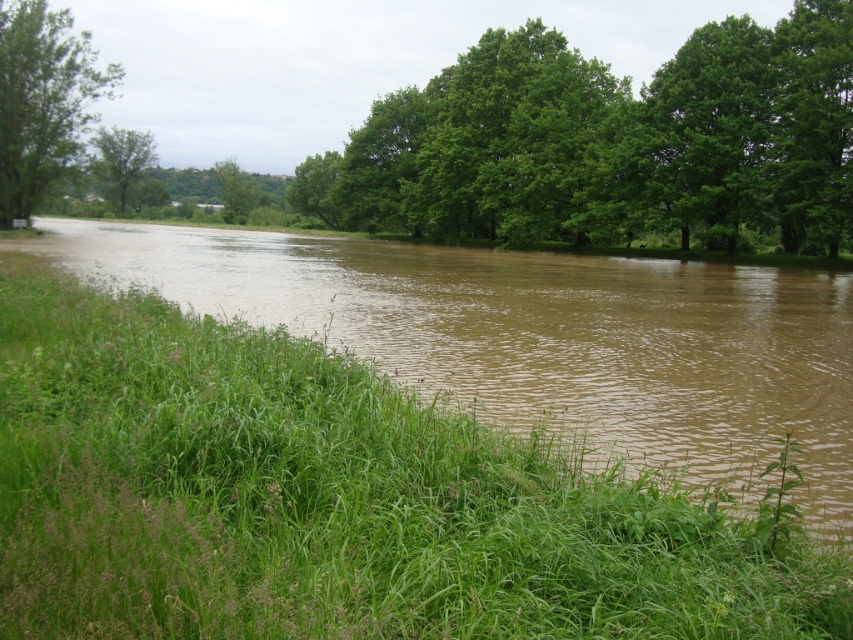
Question: Which point appears closest to the camera in this image?

Choices:
 (A) (807, 460)
 (B) (225, 170)

Answer: (A)

Question: Does brown muddy water at center have a lesser width compared to green leafy tree at center?

Choices:
 (A) no
 (B) yes

Answer: (A)

Question: Does green leafy trees at upper center have a lesser width compared to green leafy tree at center?

Choices:
 (A) no
 (B) yes

Answer: (A)

Question: Does brown muddy water at center appear over green leafy trees at upper center?

Choices:
 (A) no
 (B) yes

Answer: (A)

Question: Which of the following is the farthest from the observer?

Choices:
 (A) green leafy tree at center
 (B) green leafy tree at upper left

Answer: (A)

Question: Which of the following is the farthest from the observer?

Choices:
 (A) green leafy tree at center
 (B) brown muddy water at center
 (C) green leafy tree at left

Answer: (A)